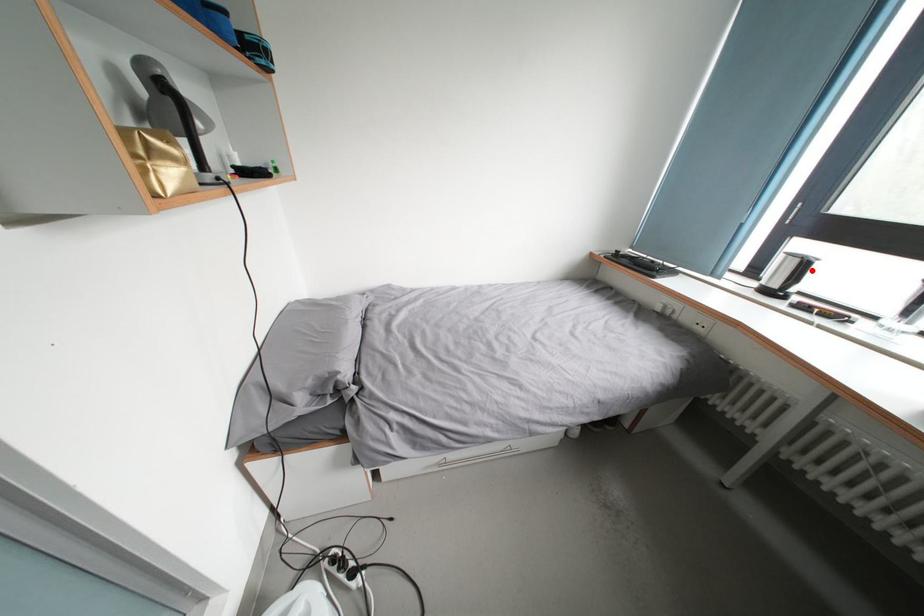
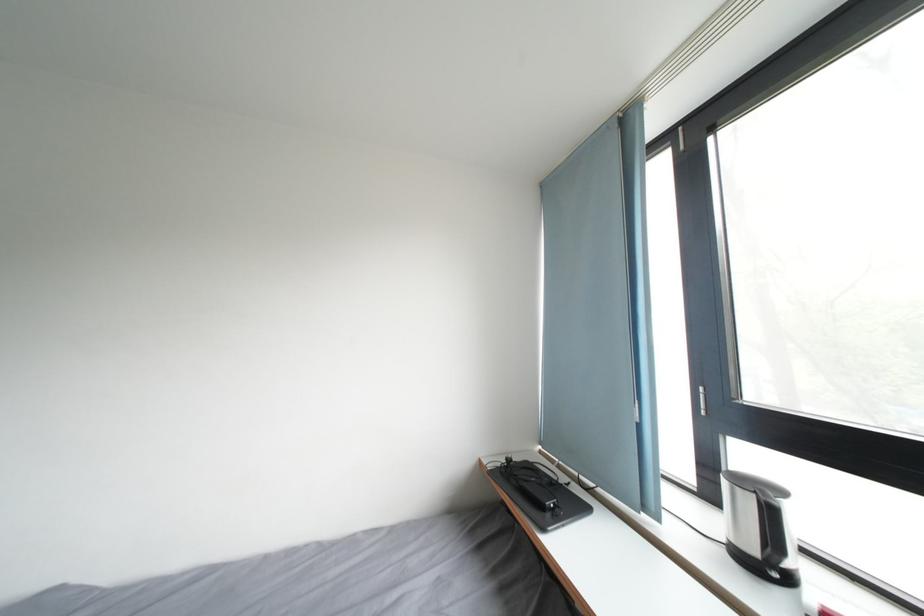
In the second image, find the point that corresponds to the highlighted location in the first image.

(776, 517)